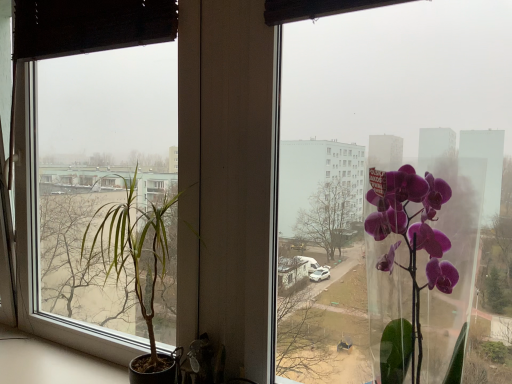
Question: From a real-world perspective, relative to transparent glass vase at right, is green leafy plant at left vertically above or below?

Choices:
 (A) above
 (B) below

Answer: (B)

Question: From the image's perspective, is green leafy plant at left positioned above or below transparent glass vase at right?

Choices:
 (A) below
 (B) above

Answer: (A)

Question: Estimate the real-world distances between objects in this image. Which object is closer to the green leafy plant at left?

Choices:
 (A) transparent glass window at center
 (B) transparent glass vase at right

Answer: (B)

Question: Which of these objects is positioned closest to the green leafy plant at left?

Choices:
 (A) transparent glass vase at right
 (B) transparent glass window at center

Answer: (A)